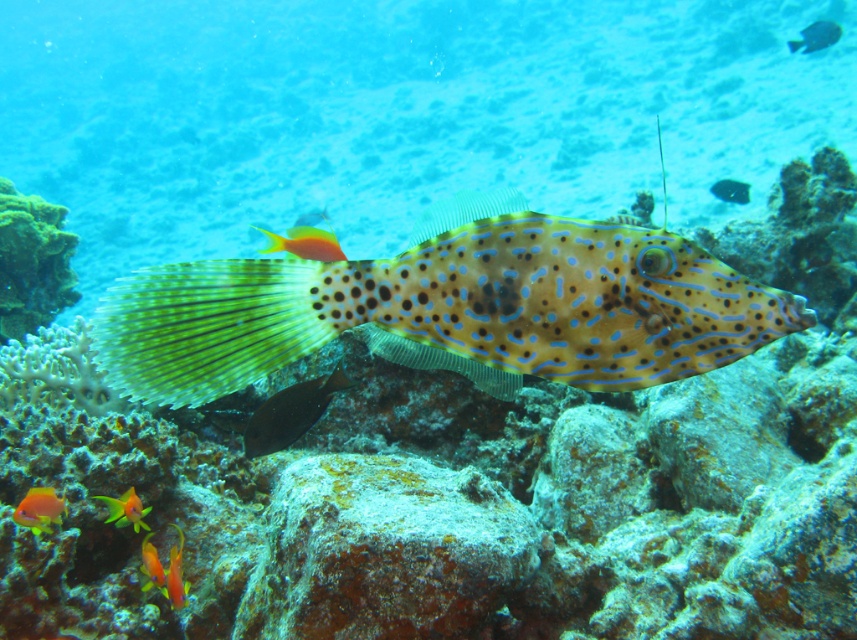
You are an underwater photographer aiming to capture the vibrant marine life. You notice two points in your viewfinder labeled as point [181,221] and point [732,179]. Which point is closer to the camera?

Point [732,179] is closer to the camera because the description states that point [181,221] is behind point [732,179].

You are a diver underwater and want to reach the point closer to you. Which point should you swim towards, point (826, 40) or point (148, 572)?

You should swim towards point (148, 572) because point (826, 40) is further away from you than point (148, 572).

You are a scuba diver swimming in the underwater scene. You notice two points marked in the image. Which point is closer to you, point (303,392) or point (31,513)?

Point (303,392) is closer to you because it is further to the viewer than point (31,513).